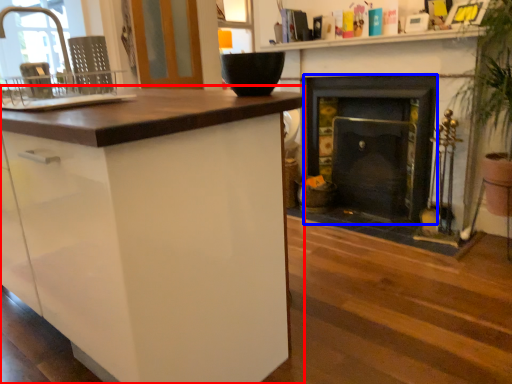
Question: Which point is closer to the camera, cabinetry (highlighted by a red box) or fireplace (highlighted by a blue box)?

Choices:
 (A) cabinetry
 (B) fireplace

Answer: (A)